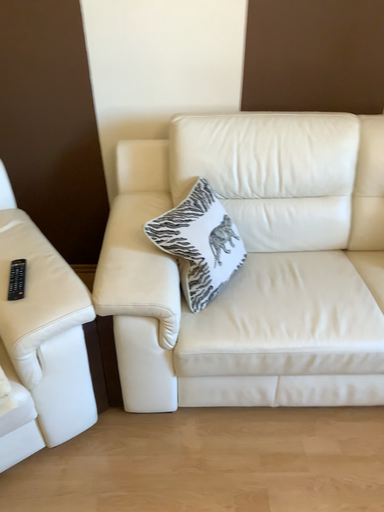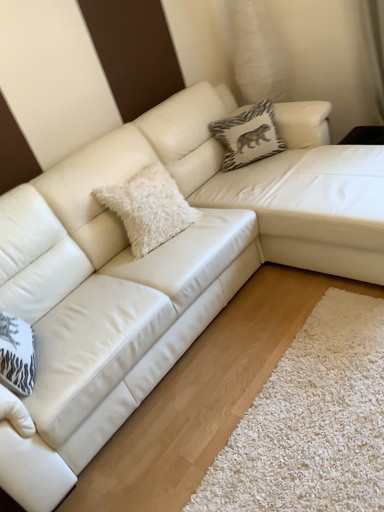
Question: How did the camera likely rotate when shooting the video?

Choices:
 (A) rotated upward
 (B) rotated downward

Answer: (A)